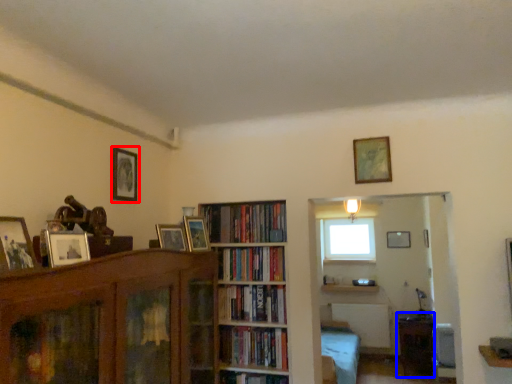
Question: Among these objects, which one is nearest to the camera, picture frame (highlighted by a red box) or table (highlighted by a blue box)?

Choices:
 (A) picture frame
 (B) table

Answer: (A)